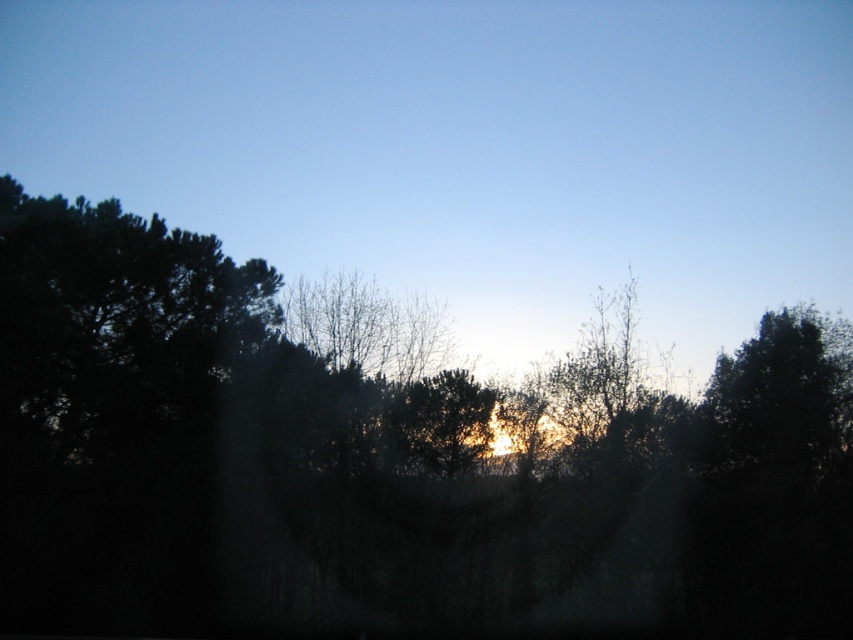
Question: In this image, where is dark green leafy tree at center located relative to golden light at center?

Choices:
 (A) left
 (B) right

Answer: (B)

Question: In this image, where is dark green leafy tree at center located relative to golden light at center?

Choices:
 (A) below
 (B) above

Answer: (A)

Question: Which point is closer to the camera taking this photo?

Choices:
 (A) (421, 532)
 (B) (61, 109)

Answer: (A)

Question: Is dark green leafy tree at center to the right of golden light at center from the viewer's perspective?

Choices:
 (A) yes
 (B) no

Answer: (A)